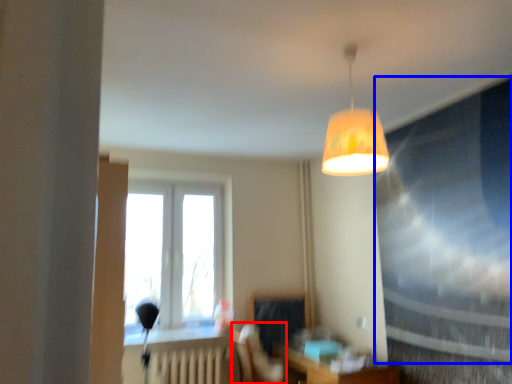
Question: Which of the following is the closest to the observer, swivel chair (highlighted by a red box) or window screen (highlighted by a blue box)?

Choices:
 (A) swivel chair
 (B) window screen

Answer: (B)